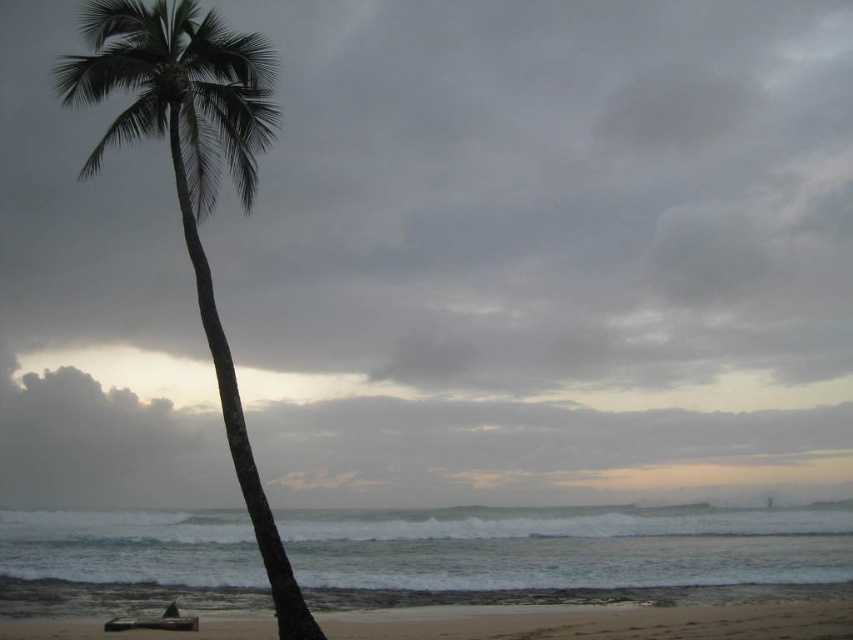
Between green leafy palm tree at left and beige sandy beach at lower center, which one is positioned higher?

green leafy palm tree at left is higher up.

At what (x,y) coordinates should I click in order to perform the action: click on green leafy palm tree at left. Please return your answer as a coordinate pair (x, y). The image size is (853, 640). Looking at the image, I should click on (193, 179).

At what (x,y) coordinates should I click in order to perform the action: click on green leafy palm tree at left. Please return your answer as a coordinate pair (x, y). This screenshot has width=853, height=640. Looking at the image, I should click on (193, 179).